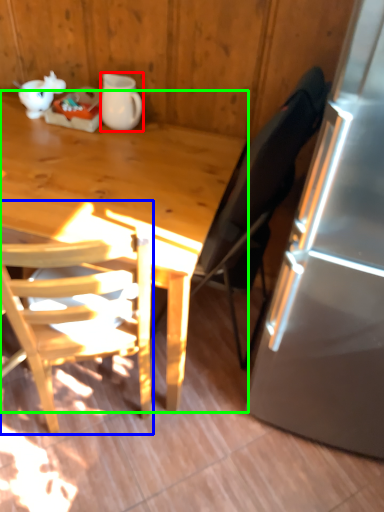
Question: Based on their relative distances, which object is farther from pitcher (highlighted by a red box)? Choose from chair (highlighted by a blue box) and desk (highlighted by a green box).

Choices:
 (A) chair
 (B) desk

Answer: (A)